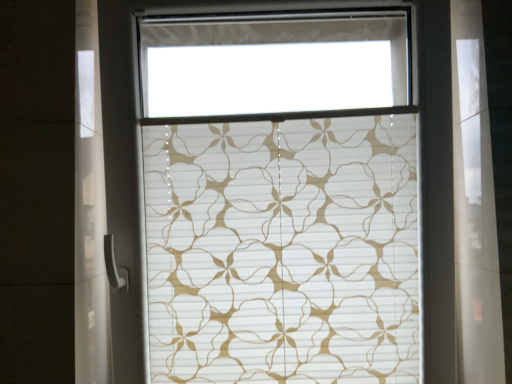
Looking at this image, measure the distance between point (205, 240) and camera.

Result: Point (205, 240) is 37.95 inches away from camera.

What do you see at coordinates (283, 251) in the screenshot?
I see `white textured blinds at center` at bounding box center [283, 251].

At what (x,y) coordinates should I click in order to perform the action: click on white textured blinds at center. Please return your answer as a coordinate pair (x, y). The height and width of the screenshot is (384, 512). Looking at the image, I should click on (283, 251).

In order to click on white textured blinds at center in this screenshot , I will do `click(283, 251)`.